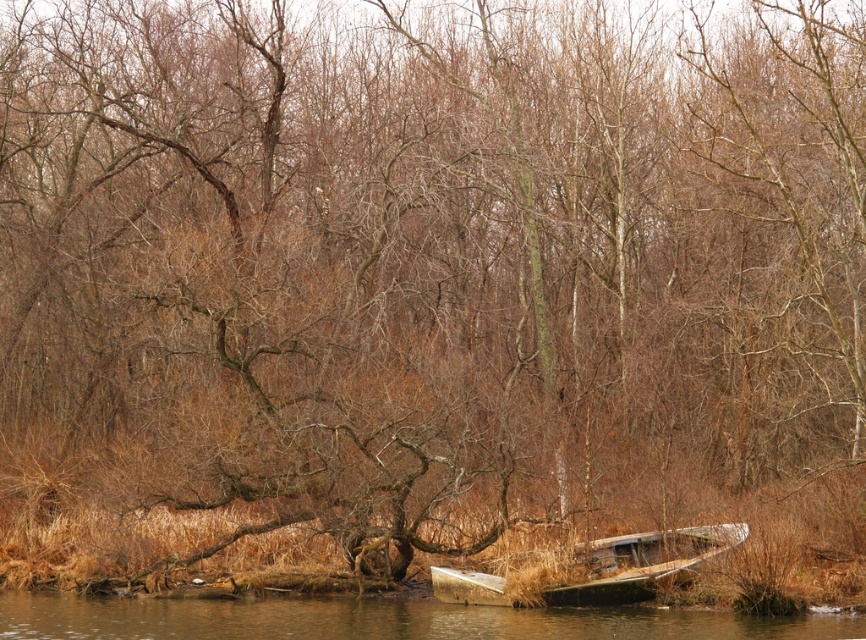
Question: Is brown wooden boat at lower center below rusty metal boat at lower right?

Choices:
 (A) no
 (B) yes

Answer: (B)

Question: Can you confirm if brown wooden boat at lower center is positioned to the right of rusty metal boat at lower right?

Choices:
 (A) yes
 (B) no

Answer: (B)

Question: Which of the following is the farthest from the observer?

Choices:
 (A) (527, 612)
 (B) (580, 552)

Answer: (B)

Question: Does brown wooden boat at lower center appear over rusty metal boat at lower right?

Choices:
 (A) no
 (B) yes

Answer: (A)

Question: Which point is closer to the camera?

Choices:
 (A) rusty metal boat at lower right
 (B) brown wooden boat at lower center

Answer: (B)

Question: Which of the following is the farthest from the observer?

Choices:
 (A) brown wooden boat at lower center
 (B) rusty metal boat at lower right

Answer: (B)